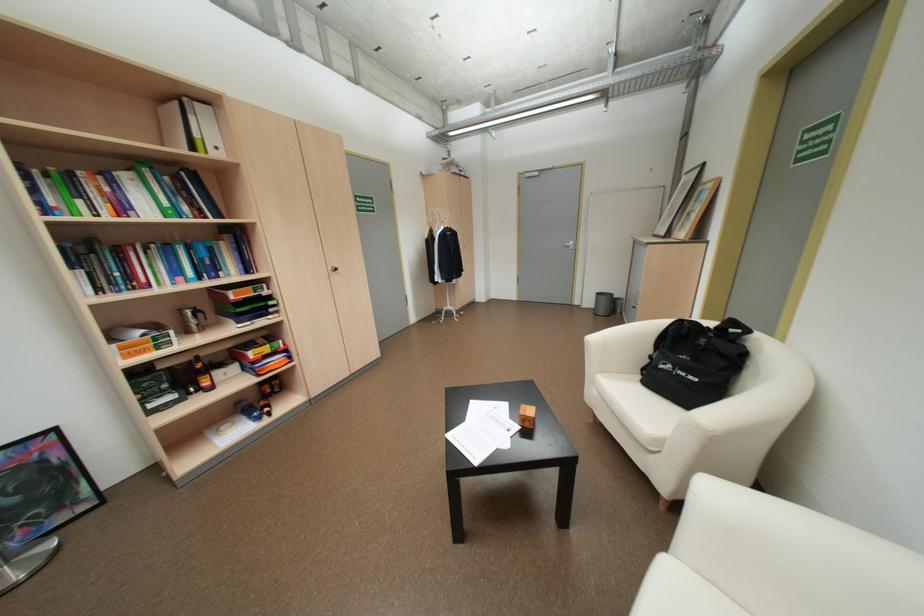
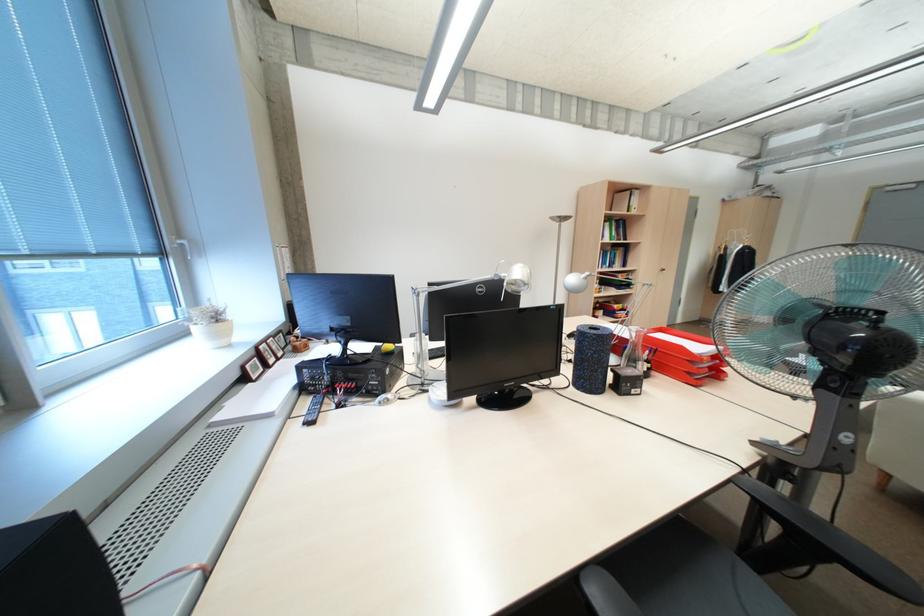
Find the pixel in the second image that matches point 132,207 in the first image.

(612, 236)